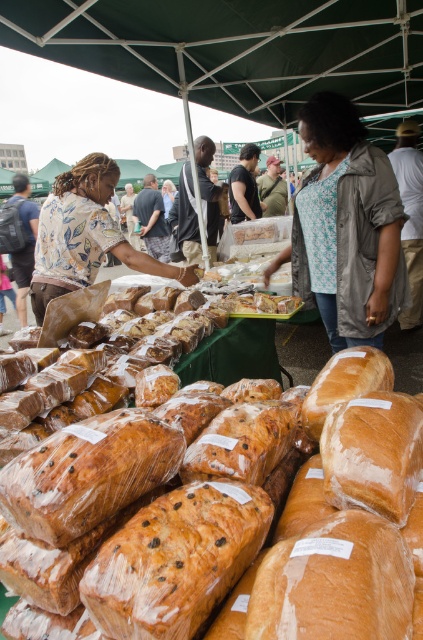
You are a vendor at the market and need to determine which customer has a wider torso based on their clothing. The customers in question are wearing the floral shirt at center and the dark brown leather jacket at center. Which clothing item indicates a wider torso?

The floral shirt at center has a larger width than the dark brown leather jacket at center, so the customer wearing the floral shirt at center has a wider torso.

You are standing in the outdoor market scene. There is a point marked at coordinates (x=85, y=236). What object or person is located at this point?

The point at coordinates (x=85, y=236) marks the location of the floral shirt at center.